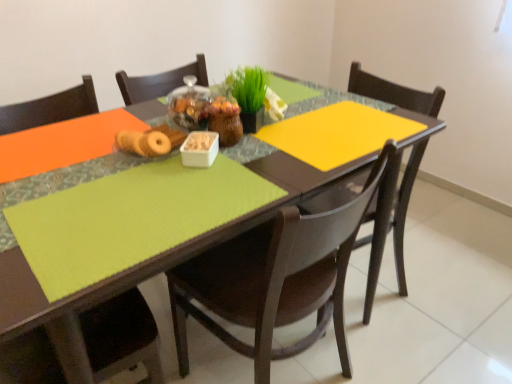
The height and width of the screenshot is (384, 512). I want to click on vacant space situated on the left part of matte brown donuts at center, so click(x=75, y=170).